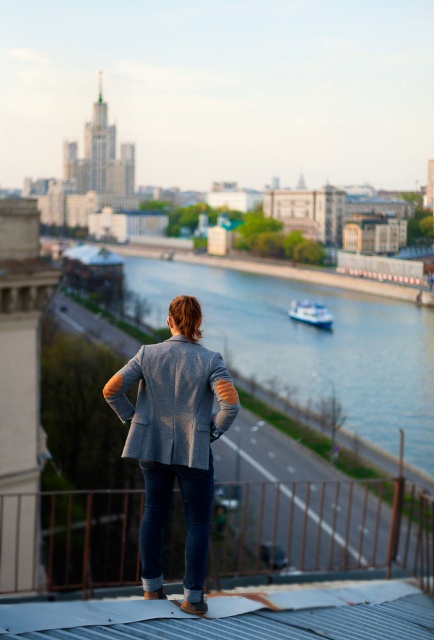
You are standing on the rooftop and want to place a rectangular box that is 1 meter wide between the brown metal railing at lower center and the white glossy boat at center. Can the box fit horizontally between them?

The brown metal railing at lower center is wider than the white glossy boat at center, but the description does not specify the distance between them. Therefore, it is impossible to determine if the box can fit horizontally between them.